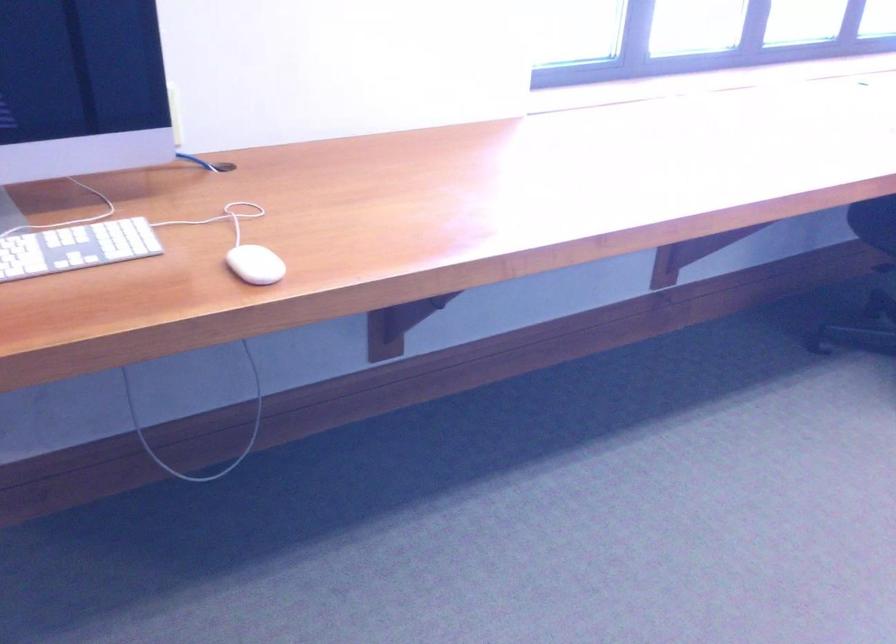
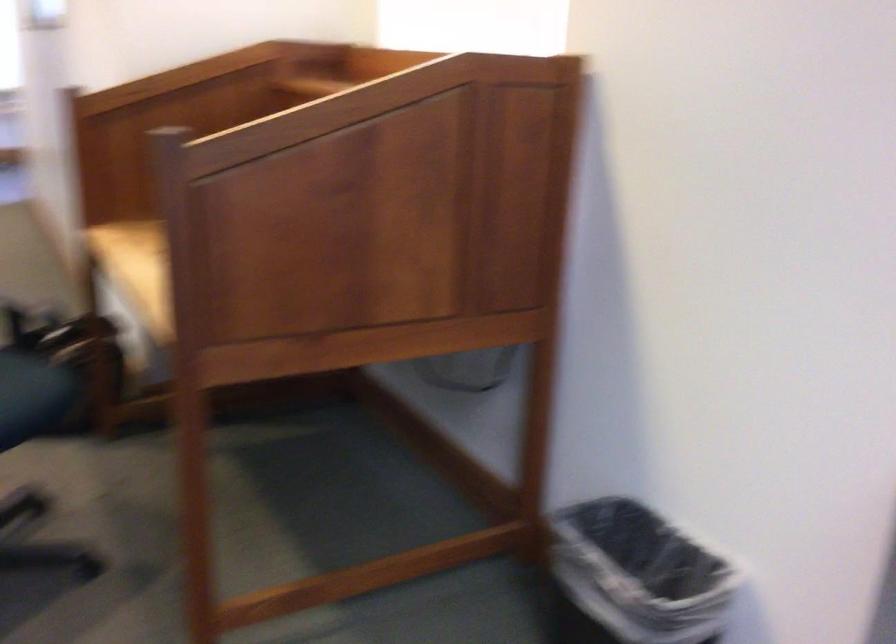
Question: The camera is either moving clockwise (left) or counter-clockwise (right) around the object. The first image is from the beginning of the video and the second image is from the end. Is the camera moving left or right when shooting the video?

Choices:
 (A) Left
 (B) Right

Answer: (B)